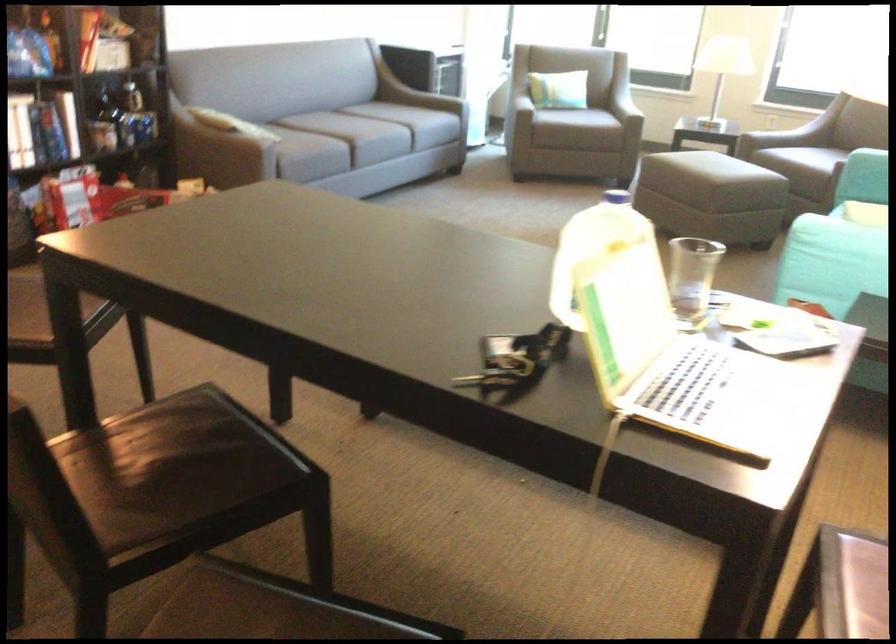
What do you see at coordinates (428, 100) in the screenshot? I see `the sofa armrest` at bounding box center [428, 100].